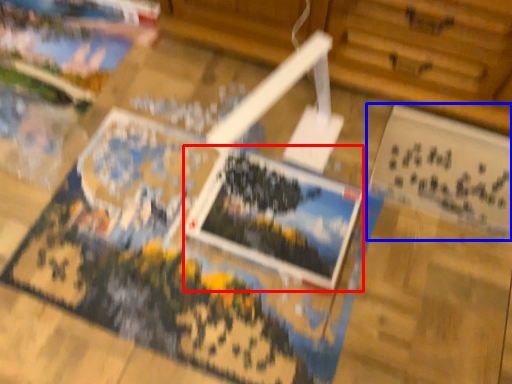
Question: Which object appears farthest to the camera in this image, postcard (highlighted by a red box) or postcard (highlighted by a blue box)?

Choices:
 (A) postcard
 (B) postcard

Answer: (B)